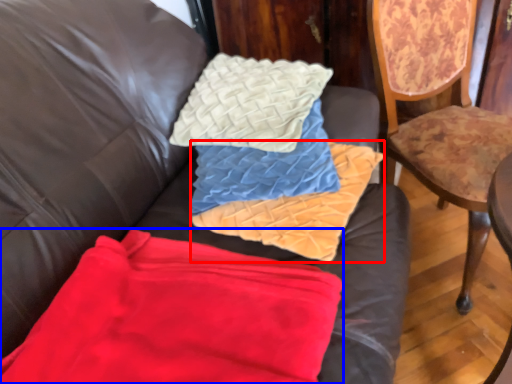
Question: Among these objects, which one is farthest to the camera, material (highlighted by a red box) or material (highlighted by a blue box)?

Choices:
 (A) material
 (B) material

Answer: (A)